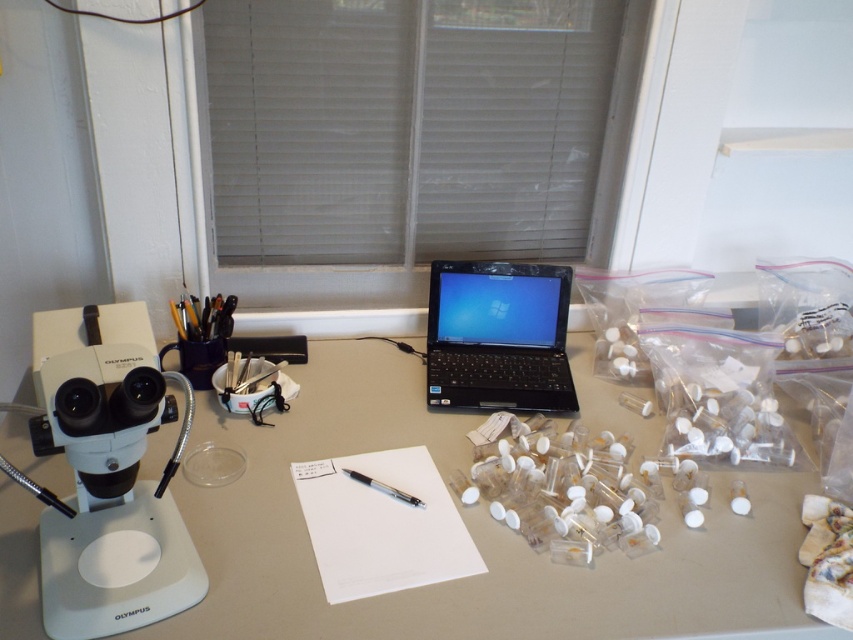
You are organizing your desk and want to place a new item between the white plastic table at center and the white paper at center. Given that the space between them is 4.66 inches, can you fit a 4.5 inch wide item there?

The space between the white plastic table at center and the white paper at center is 4.66 inches. Since the item is 4.5 inches wide, which is narrower than the available space, it should fit comfortably between them.

You are organizing the desk and need to place a new item between the white plastic microscope at left and the black metallic pen at center. Is there enough space for it?

The white plastic microscope at left is to the left of the black metallic pen at center, so there is space between them to place a new item.